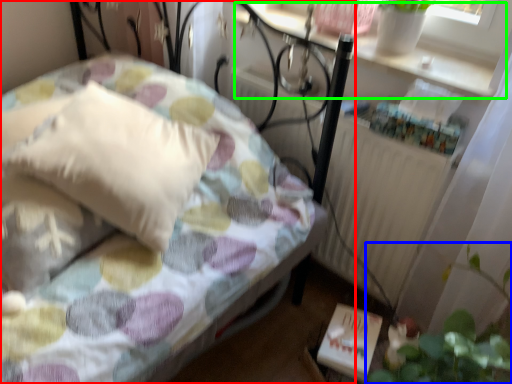
Question: Which object is the farthest from bed (highlighted by a red box)? Choose among these: plant (highlighted by a blue box) or window sill (highlighted by a green box).

Choices:
 (A) plant
 (B) window sill

Answer: (A)